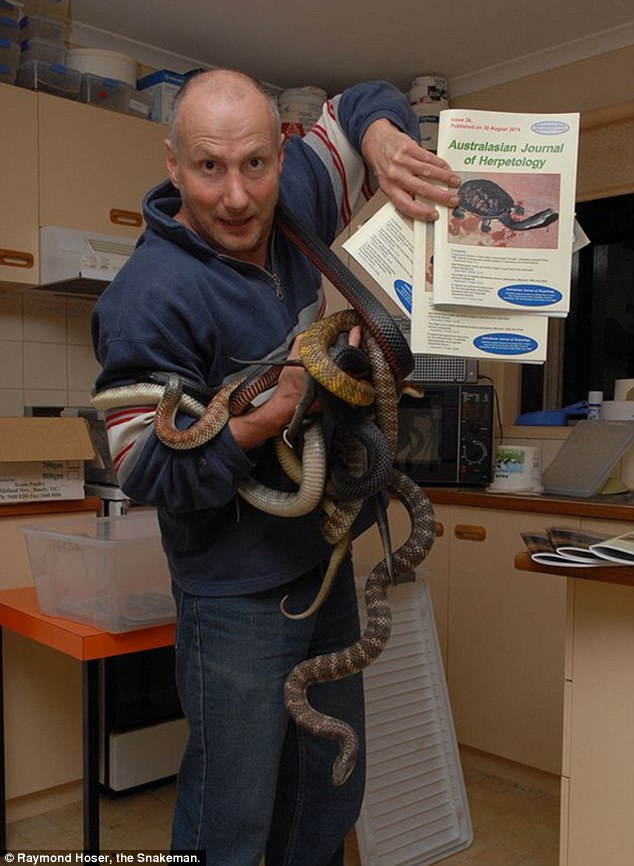
Locate an element on the screen. Image resolution: width=634 pixels, height=866 pixels. table is located at coordinates (87, 650).